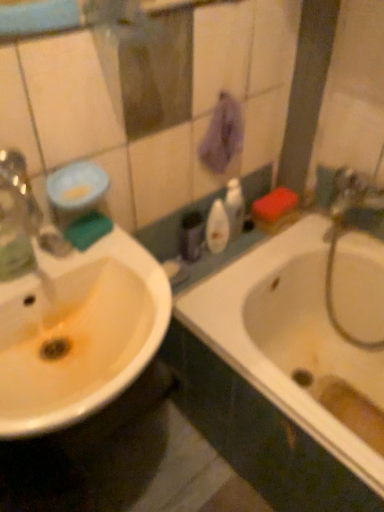
Where is `free spot to the right of matte purple container at center, the first toiletry from the left`? free spot to the right of matte purple container at center, the first toiletry from the left is located at coordinates (228, 258).